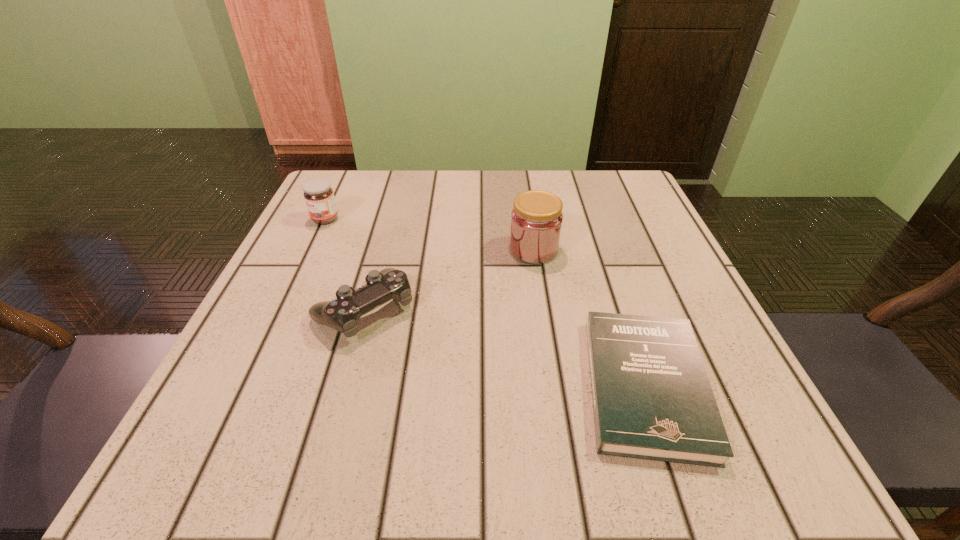
Identify the location of free space at the left edge of the desktop. (352, 274).

Identify the location of vacant space at the right edge of the desktop. The height and width of the screenshot is (540, 960). (637, 226).

Locate an element on the screen. The width and height of the screenshot is (960, 540). free space at the far left corner of the desktop is located at coordinates (339, 208).

In the image, there is a desktop. In order to click on blank space at the near left corner in this screenshot , I will do `click(193, 446)`.

In the image, there is a desktop. At what (x,y) coordinates should I click in order to perform the action: click on vacant space at the far right corner. Please return your answer as a coordinate pair (x, y). Looking at the image, I should click on (637, 185).

Find the location of `free spot at the near right corner of the desktop`. free spot at the near right corner of the desktop is located at coordinates (744, 448).

Locate an element on the screen. free point between the nearer jam and the left jam is located at coordinates (429, 234).

Where is `free area in between the left jam and the shortest object`? The width and height of the screenshot is (960, 540). free area in between the left jam and the shortest object is located at coordinates (486, 302).

The image size is (960, 540). In order to click on free space between the second object from left to right and the leftmost object in this screenshot , I will do `click(345, 265)`.

I want to click on free point between the tallest object and the control, so click(449, 280).